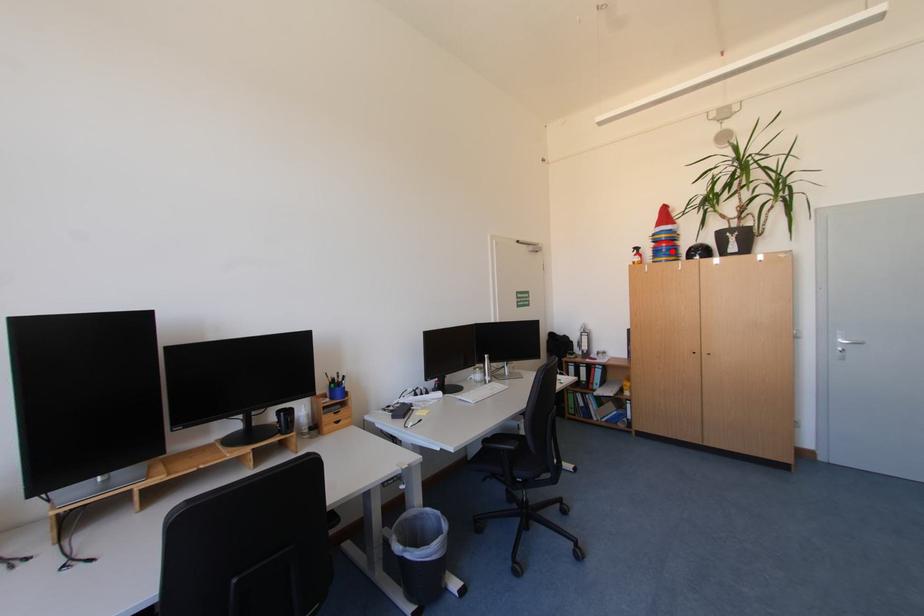
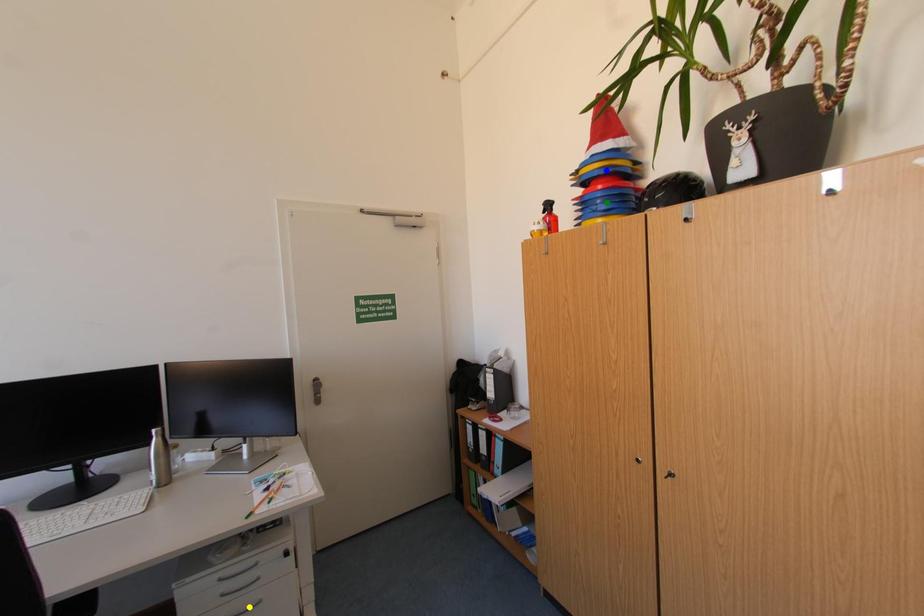
Question: I am providing you with two images of the same scene from different viewpoints. A red point is marked on the first image. You are given multiple points on the second image. Which point in image 2 represents the same 3d spot as the red point in image 1?

Choices:
 (A) green point
 (B) yellow point
 (C) blue point

Answer: (A)